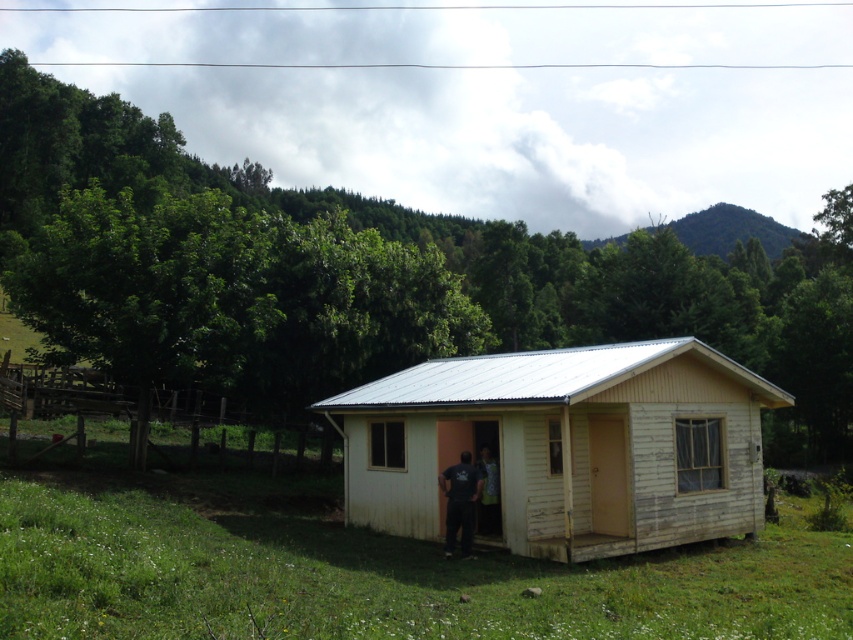
Question: Is yellow wood cabin at center to the left of dark blue fabric at center from the viewer's perspective?

Choices:
 (A) no
 (B) yes

Answer: (A)

Question: Which point is closer to the camera taking this photo?

Choices:
 (A) (476, 477)
 (B) (395, 397)
 (C) (480, 465)

Answer: (A)

Question: Is yellow wood cabin at center wider than dark blue fabric at center?

Choices:
 (A) yes
 (B) no

Answer: (A)

Question: Which point is closer to the camera?

Choices:
 (A) 440,506
 (B) 486,456
 (C) 471,545

Answer: (C)

Question: Which of the following is the closest to the observer?

Choices:
 (A) (604, 445)
 (B) (486, 524)

Answer: (B)

Question: Considering the relative positions of dark gray fabric pants at center and dark blue fabric at center in the image provided, where is dark gray fabric pants at center located with respect to dark blue fabric at center?

Choices:
 (A) left
 (B) right

Answer: (A)